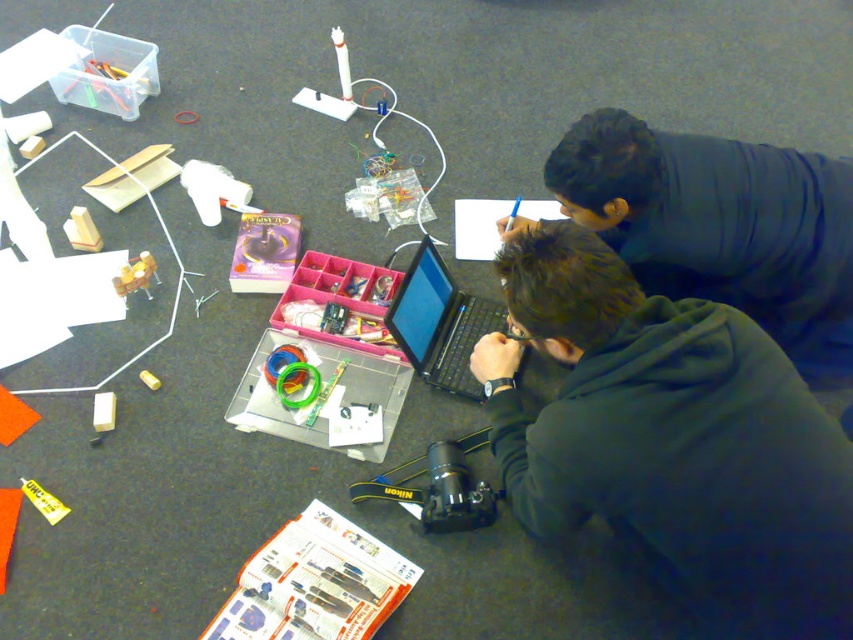
You are trying to locate the dark blue hoodie at upper right and the black matte laptop at center in the workspace. According to the scene description, which object is positioned higher up?

The dark blue hoodie at upper right is located above the black matte laptop at center, so it is positioned higher up.

You are a photographer needing to capture both the dark gray hoodie at center and the dark blue hoodie at upper right in a single frame. Based on their positions, which hoodie is closer to the left edge of the photo?

The dark gray hoodie at center is closer to the left edge of the photo since it is positioned to the left of the dark blue hoodie at upper right.